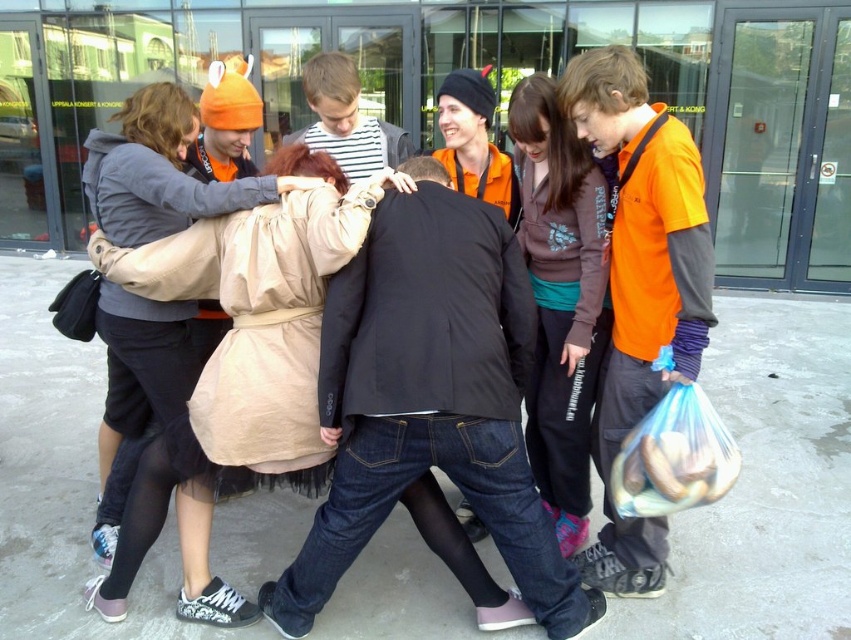
Question: Considering the relative positions of brown fleece jacket at center and translucent plastic bag at lower right in the image provided, where is brown fleece jacket at center located with respect to translucent plastic bag at lower right?

Choices:
 (A) above
 (B) below

Answer: (A)

Question: Can you confirm if brown fleece jacket at center is smaller than translucent plastic bag at lower right?

Choices:
 (A) yes
 (B) no

Answer: (B)

Question: Does brown fleece jacket at center appear over translucent plastic bag at lower right?

Choices:
 (A) yes
 (B) no

Answer: (A)

Question: Which of these objects is positioned closest to the brown fleece jacket at center?

Choices:
 (A) translucent plastic bag at lower right
 (B) beige fabric coat at left

Answer: (A)

Question: Which point appears closest to the camera in this image?

Choices:
 (A) (643, 417)
 (B) (135, 330)

Answer: (A)

Question: Estimate the real-world distances between objects in this image. Which object is closer to the translucent plastic bag at lower right?

Choices:
 (A) brown fleece jacket at center
 (B) beige fabric coat at left

Answer: (A)